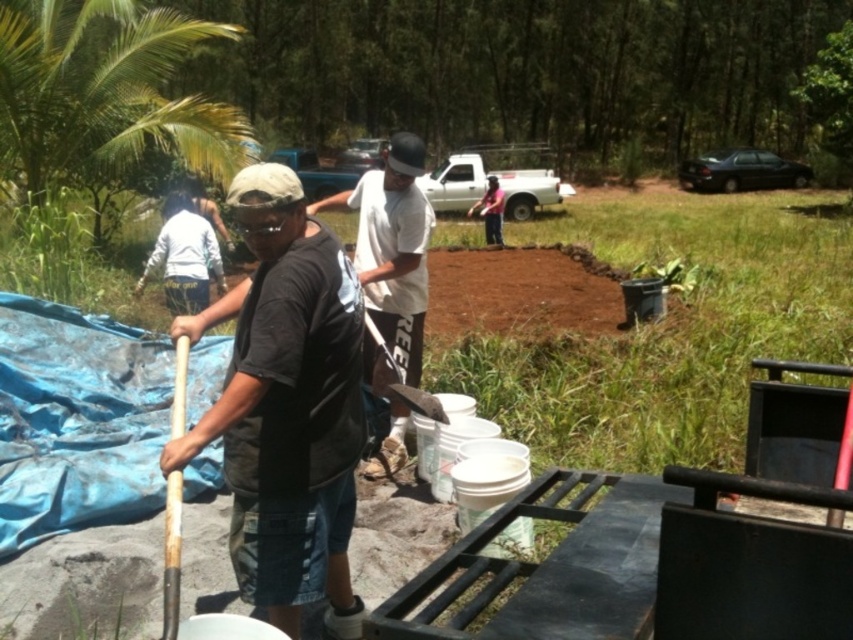
Can you confirm if dark gray t-shirt at center is thinner than wooden handle shovel at center?

In fact, dark gray t-shirt at center might be wider than wooden handle shovel at center.

Does dark gray t-shirt at center have a smaller size compared to wooden handle shovel at center?

Actually, dark gray t-shirt at center might be larger than wooden handle shovel at center.

The width and height of the screenshot is (853, 640). What do you see at coordinates (286, 406) in the screenshot?
I see `dark gray t-shirt at center` at bounding box center [286, 406].

Where is `dark gray t-shirt at center`? This screenshot has height=640, width=853. dark gray t-shirt at center is located at coordinates (286, 406).

Locate an element on the screen. Image resolution: width=853 pixels, height=640 pixels. dark gray t-shirt at center is located at coordinates (286, 406).

Is dark gray t-shirt at center to the left of white cotton shirt at center from the viewer's perspective?

Indeed, dark gray t-shirt at center is positioned on the left side of white cotton shirt at center.

In order to click on dark gray t-shirt at center in this screenshot , I will do `click(286, 406)`.

Based on the photo, is white cotton shirt at center above wooden handle shovel at center?

Indeed, white cotton shirt at center is positioned over wooden handle shovel at center.

Find the location of `white cotton shirt at center`. white cotton shirt at center is located at coordinates (392, 248).